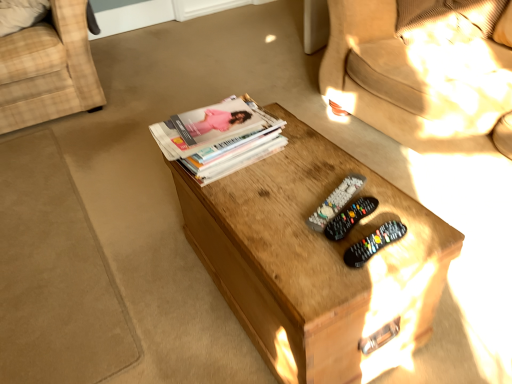
Where is `vacant area that is in front of black plastic remote control at center, marked as the second remote control in a back-to-front arrangement`? This screenshot has height=384, width=512. vacant area that is in front of black plastic remote control at center, marked as the second remote control in a back-to-front arrangement is located at coordinates (345, 276).